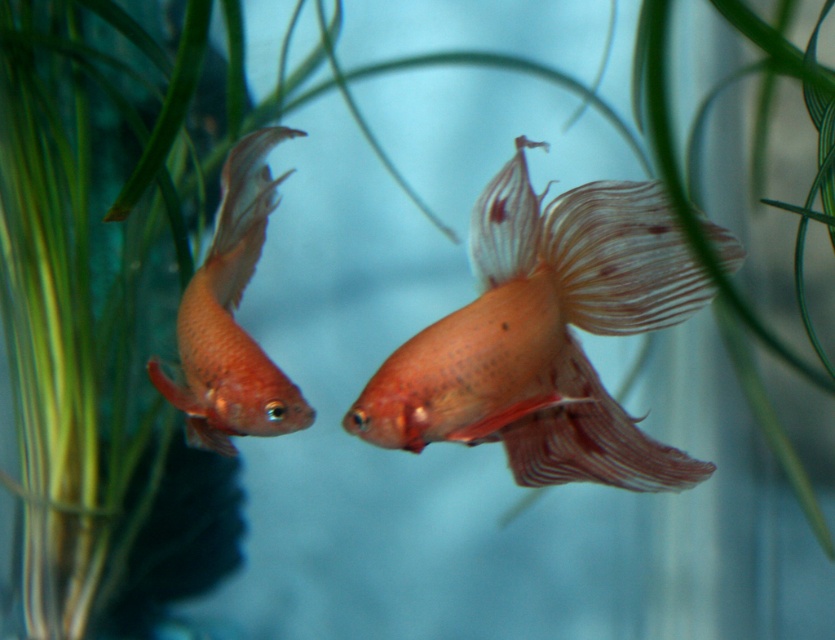
Question: Is translucent orange fish at center positioned before matte orange fish at left?

Choices:
 (A) yes
 (B) no

Answer: (A)

Question: Is translucent orange fish at center bigger than matte orange fish at left?

Choices:
 (A) yes
 (B) no

Answer: (A)

Question: Which object is farther from the camera taking this photo?

Choices:
 (A) translucent orange fish at center
 (B) matte orange fish at left

Answer: (B)

Question: Is translucent orange fish at center to the left of matte orange fish at left from the viewer's perspective?

Choices:
 (A) yes
 (B) no

Answer: (B)